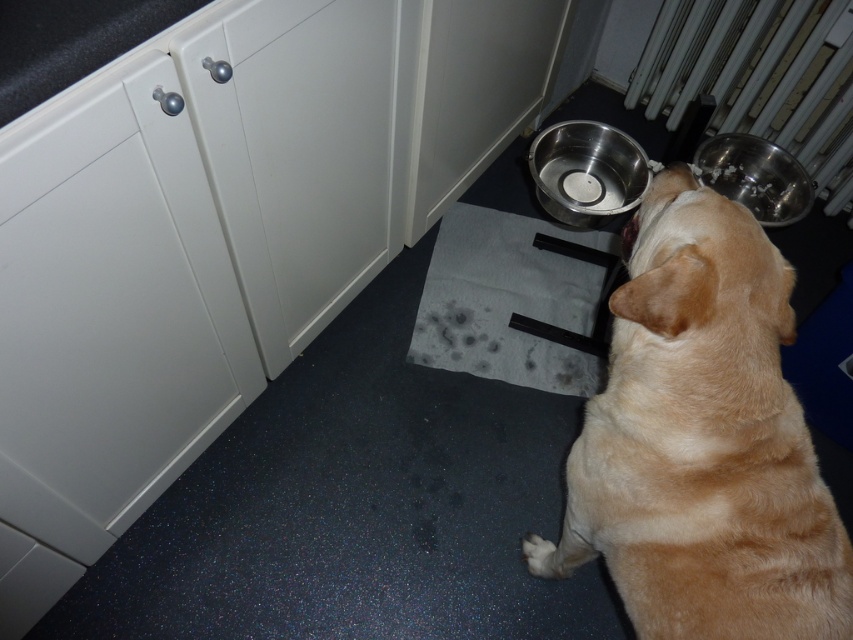
Between point (647, 531) and point (669, 84), which one is positioned behind?

The point (669, 84) is behind.

Does light brown fur at center have a lesser width compared to metallic radiator at upper right?

Yes, light brown fur at center is thinner than metallic radiator at upper right.

Who is more distant from viewer, (677, 592) or (840, 74)?

The point (840, 74) is behind.

Locate an element on the screen. The height and width of the screenshot is (640, 853). light brown fur at center is located at coordinates (701, 440).

Where is `light brown fur at center`? light brown fur at center is located at coordinates (701, 440).

Who is positioned more to the left, light brown fur at center or metallic silver bowl at lower center?

Positioned to the left is light brown fur at center.

Locate an element on the screen. The image size is (853, 640). light brown fur at center is located at coordinates (701, 440).

In order to click on light brown fur at center in this screenshot , I will do tap(701, 440).

Is light brown fur at center behind metallic silver bowl at lower right?

No.

Does light brown fur at center appear on the left side of metallic silver bowl at lower right?

Yes, light brown fur at center is to the left of metallic silver bowl at lower right.

The height and width of the screenshot is (640, 853). Identify the location of light brown fur at center. (701, 440).